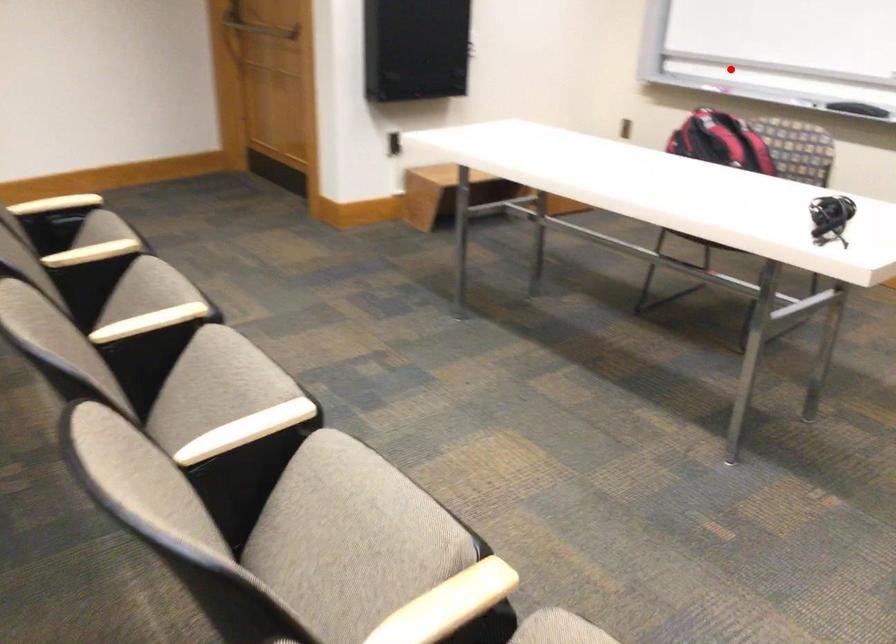
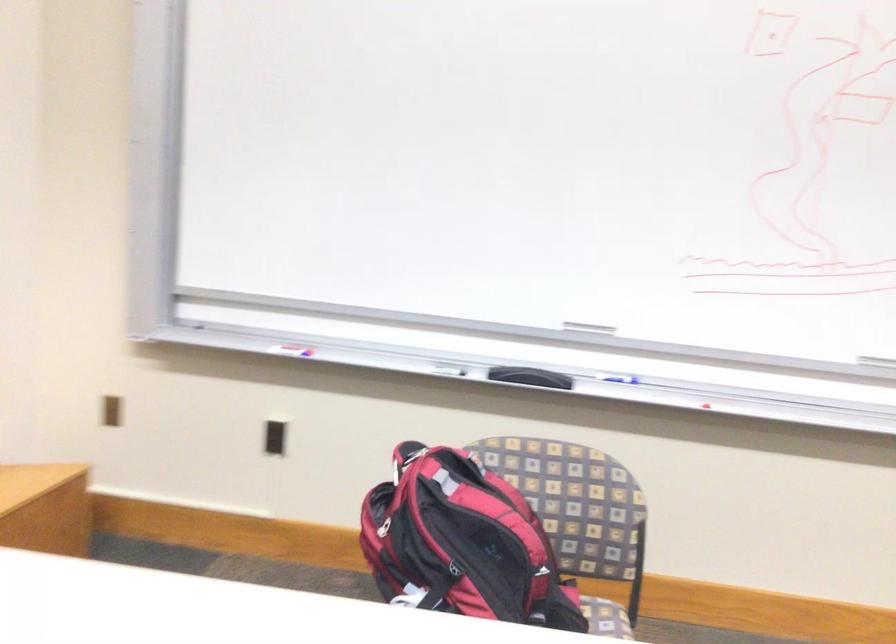
Locate, in the second image, the point that corresponds to the highlighted location in the first image.

(288, 345)